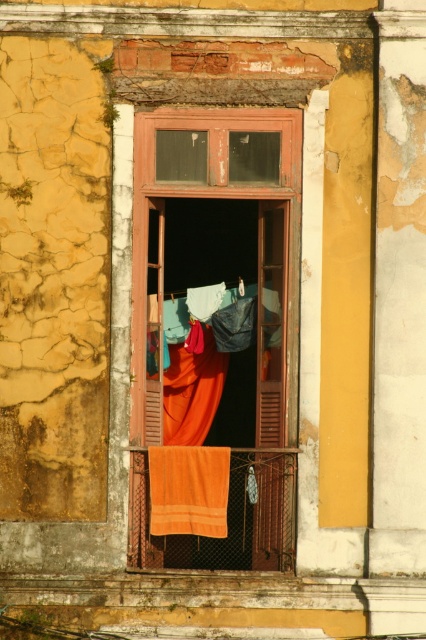
Between orange towel at lower center and orange fabric curtain at center, which one is positioned higher?

orange fabric curtain at center

What are the coordinates of `orange towel at lower center` in the screenshot? It's located at (189, 490).

Find the location of a particular element. This screenshot has height=640, width=426. orange towel at lower center is located at coordinates tap(189, 490).

Does wooden window at center appear over orange fabric curtain at center?

Correct, wooden window at center is located above orange fabric curtain at center.

Does wooden window at center come in front of orange fabric curtain at center?

Yes, it is in front of orange fabric curtain at center.

Is point (230, 387) less distant than point (175, 444)?

No.

Locate an element on the screen. wooden window at center is located at coordinates (215, 326).

Can you confirm if wooden window at center is bigger than orange towel at lower center?

No, wooden window at center is not bigger than orange towel at lower center.

Is wooden window at center taller than orange towel at lower center?

Incorrect, wooden window at center's height is not larger of orange towel at lower center's.

Which is in front, point (203, 314) or point (183, 465)?

Positioned in front is point (183, 465).

This screenshot has width=426, height=640. I want to click on wooden window at center, so click(x=215, y=326).